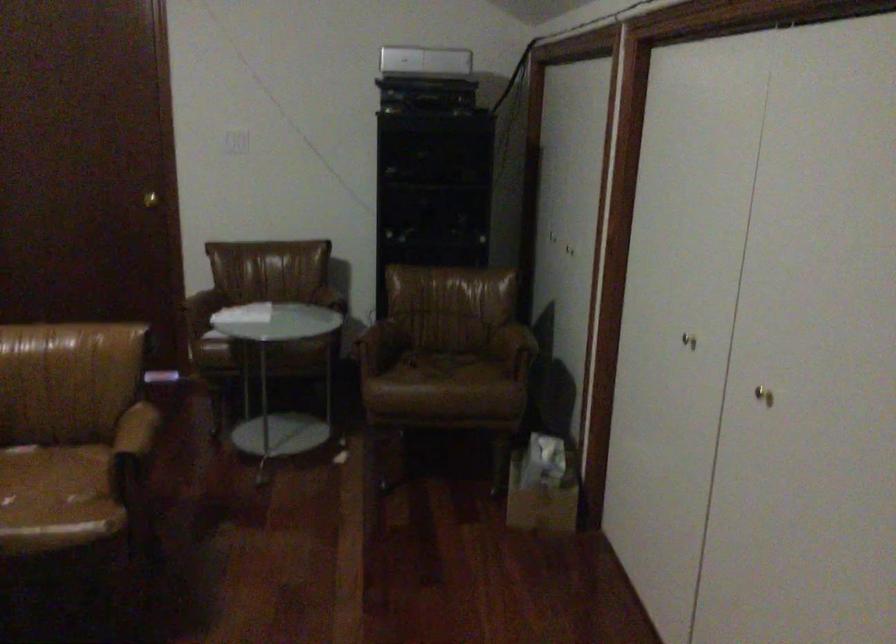
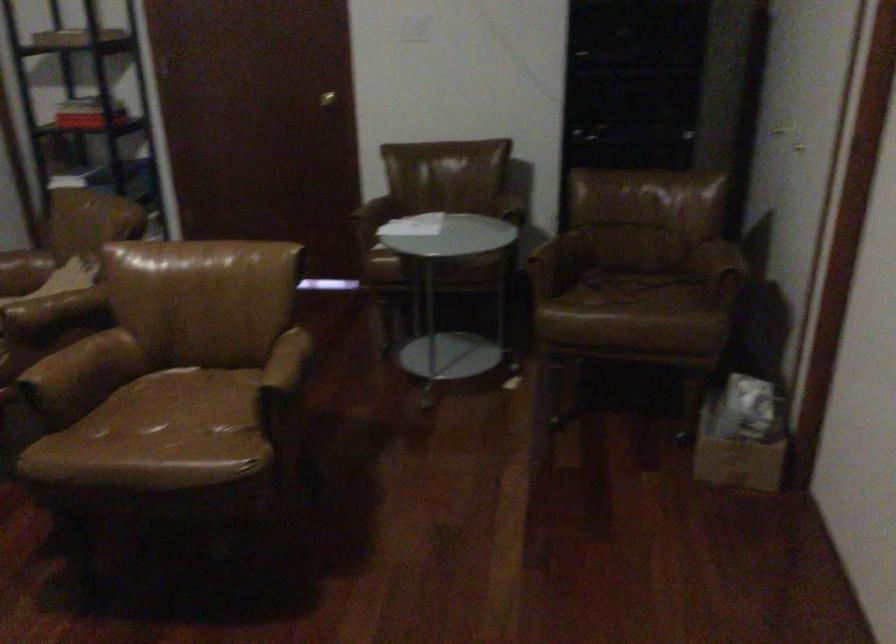
Where in the second image is the point corresponding to (x=543, y=488) from the first image?

(742, 436)